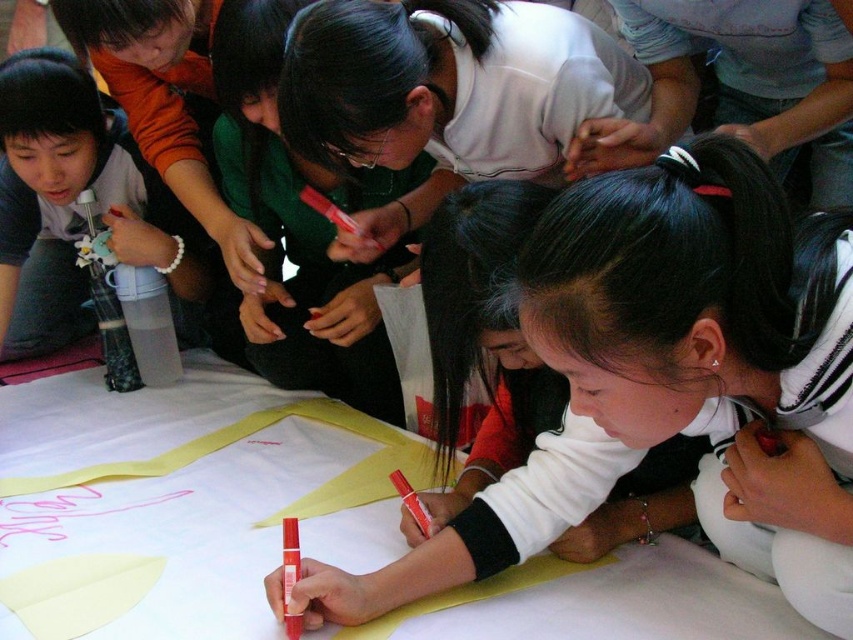
Is point (637, 252) positioned behind point (450, 300)?

No.

Is matte white marker at center further to the viewer compared to white matte shirt at center?

No, it is in front of white matte shirt at center.

The image size is (853, 640). Describe the element at coordinates (672, 378) in the screenshot. I see `matte white marker at center` at that location.

In order to click on matte white marker at center in this screenshot , I will do `click(672, 378)`.